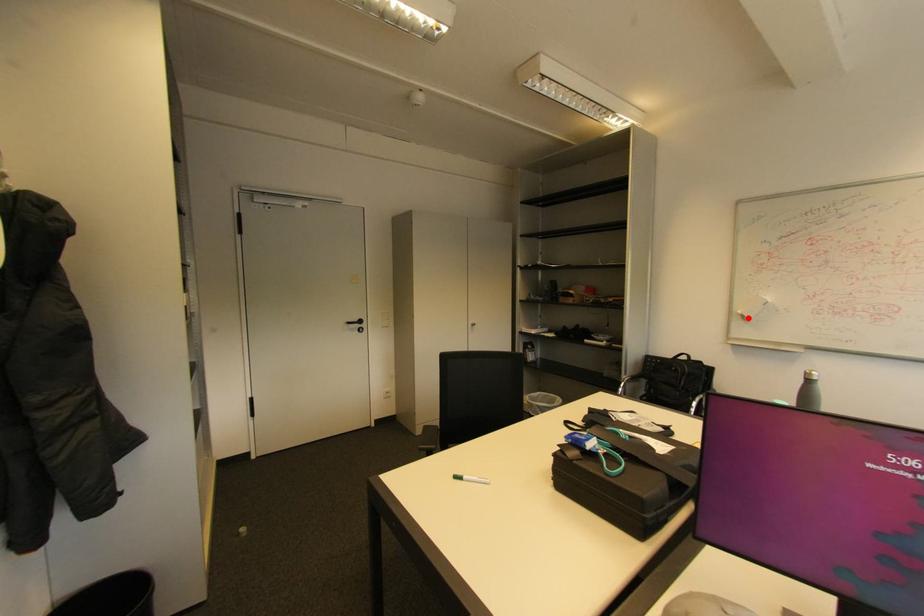
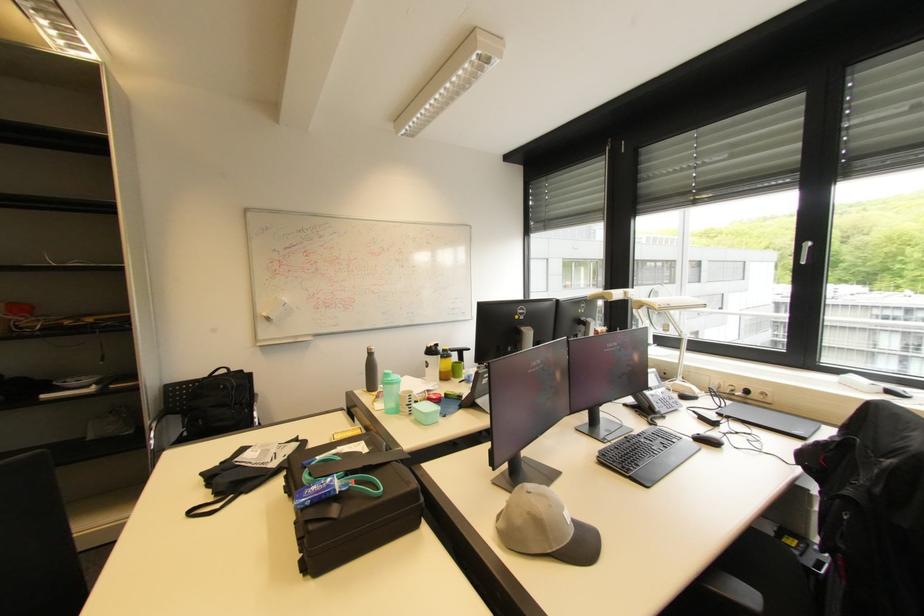
Question: I am providing you with two images of the same scene from different viewpoints. A red point is marked on the first image. At the location where the point appears in image 1, is it still visible in image 2?

Choices:
 (A) Yes
 (B) No

Answer: (A)